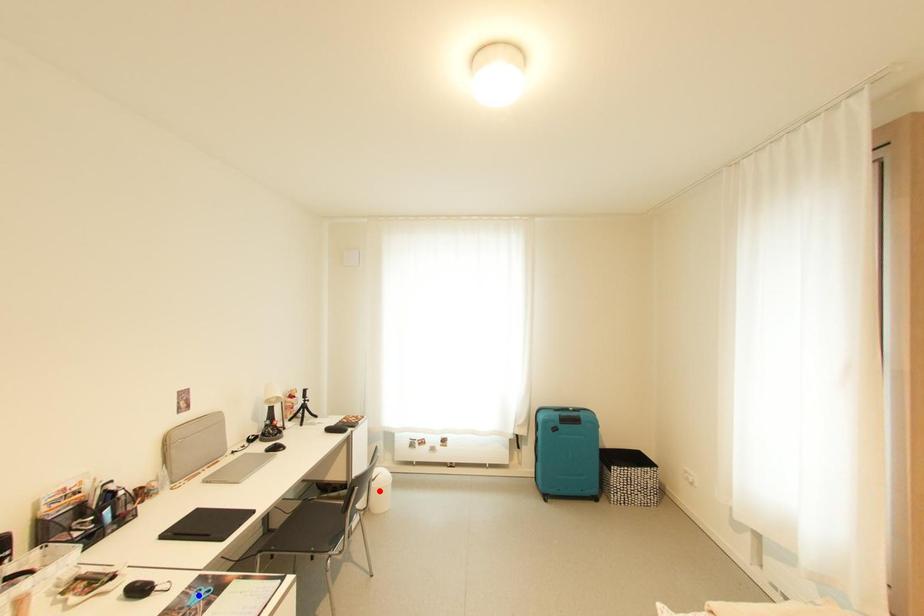
Question: Two points are marked on the image. Which point is closer to the camera?

Choices:
 (A) Blue point is closer.
 (B) Red point is closer.

Answer: (A)